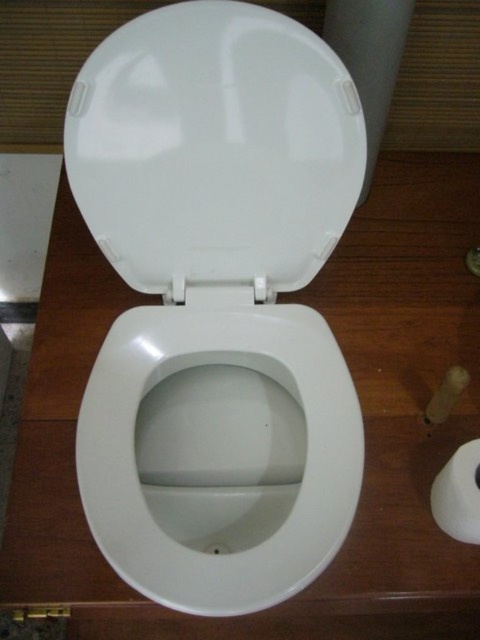
Question: Which is nearer to the white matte toilet paper at lower right?

Choices:
 (A) white glossy toilet at center
 (B) white glossy toilet bowl at center
 (C) white glossy toilet lid at center

Answer: (B)

Question: Which object appears farthest from the camera in this image?

Choices:
 (A) white glossy toilet lid at center
 (B) white glossy toilet at center
 (C) white matte toilet paper at lower right
 (D) white glossy toilet bowl at center

Answer: (C)

Question: Can you confirm if white glossy toilet at center is positioned above white glossy toilet bowl at center?

Choices:
 (A) yes
 (B) no

Answer: (A)

Question: Does white glossy toilet lid at center appear under white matte toilet paper at lower right?

Choices:
 (A) yes
 (B) no

Answer: (B)

Question: Which point is closer to the camera taking this photo?

Choices:
 (A) (236, 428)
 (B) (98, 48)

Answer: (B)

Question: Can you confirm if white glossy toilet bowl at center is positioned above white matte toilet paper at lower right?

Choices:
 (A) yes
 (B) no

Answer: (A)